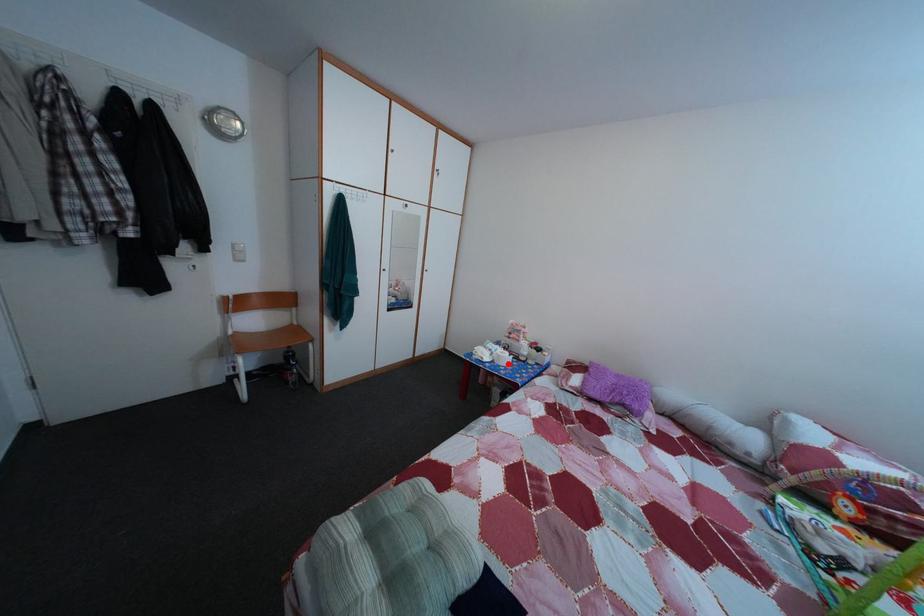
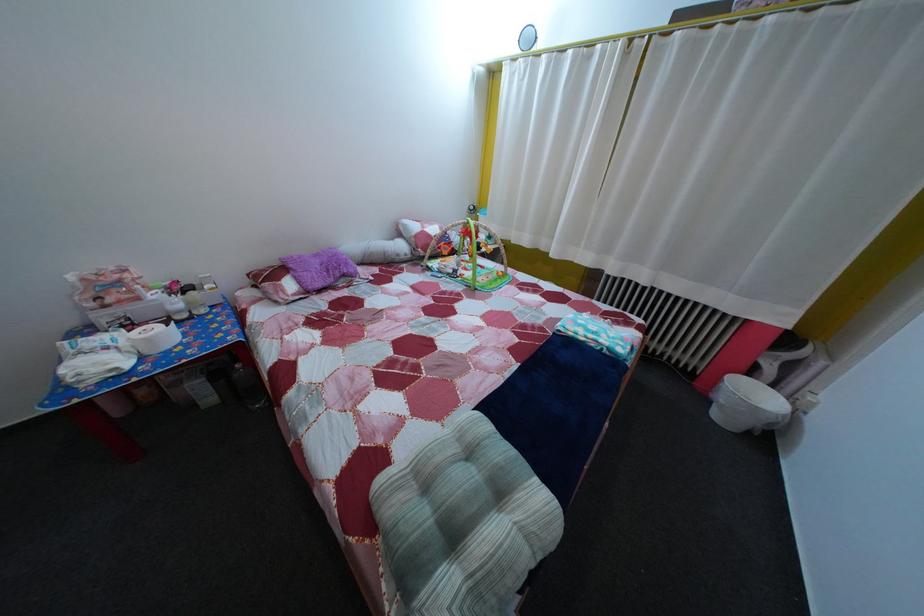
Find the pixel in the second image that matches the highlighted location in the first image.

(157, 347)